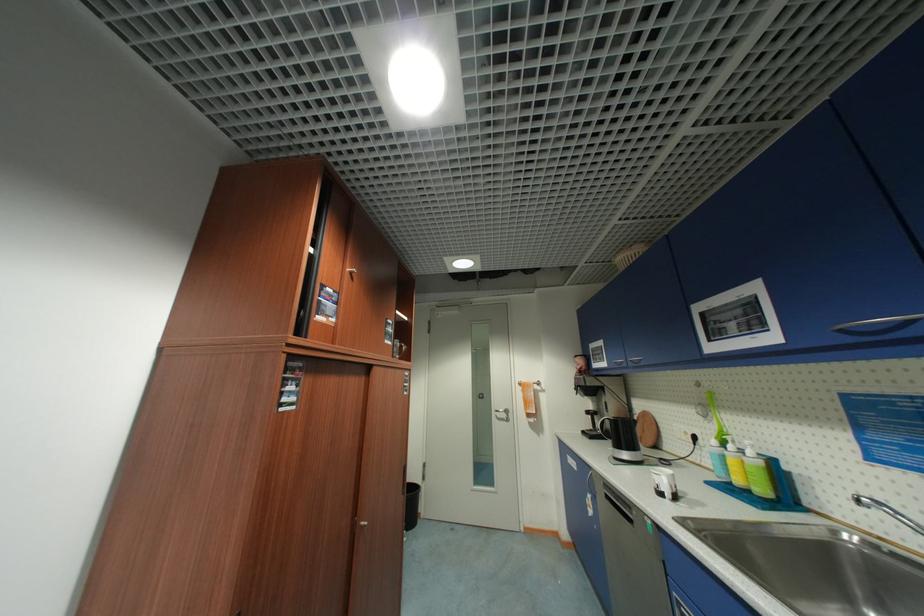
The width and height of the screenshot is (924, 616). Identify the location of yellow pump bottle. (736, 464).